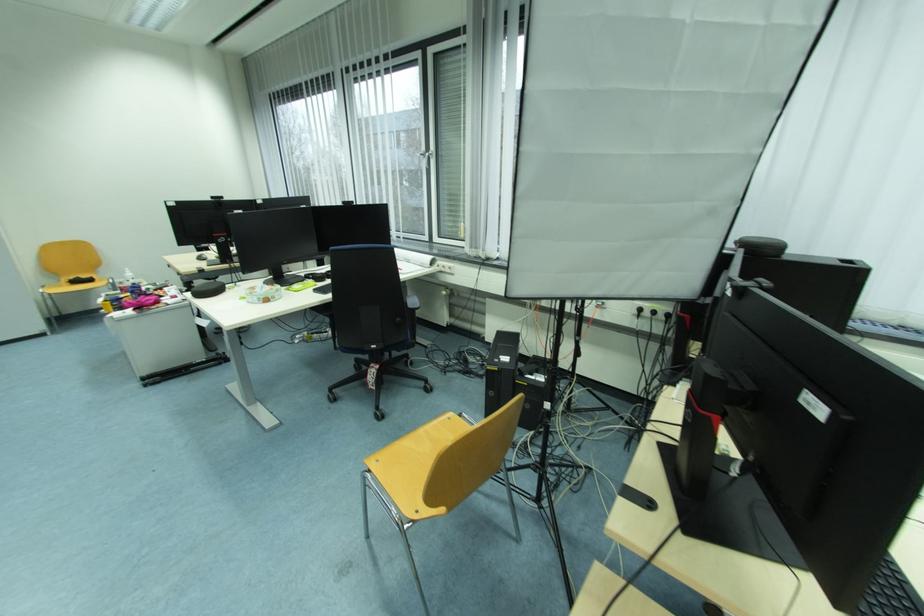
Where would you sit the yellow chair sitting surface? Please return your answer as a coordinate pair (x, y).

(74, 285)